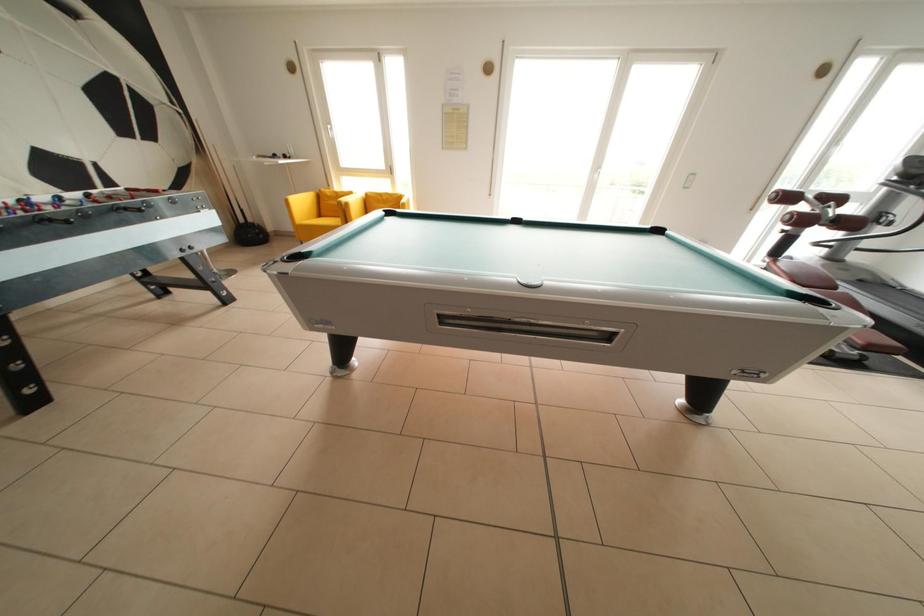
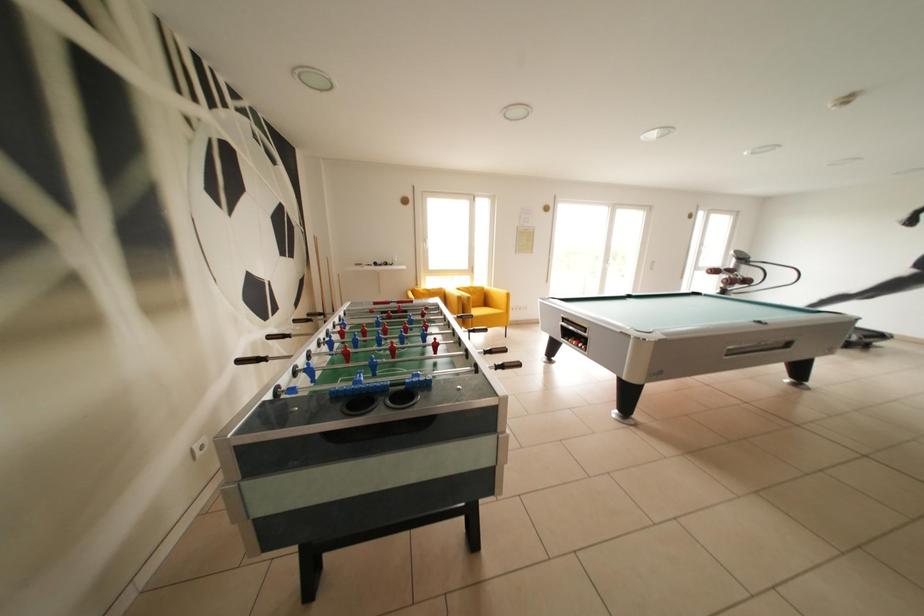
Question: The images are taken continuously from a first-person perspective. In which direction are you moving?

Choices:
 (A) Left
 (B) Right
 (C) Forward
 (D) Backward

Answer: (A)